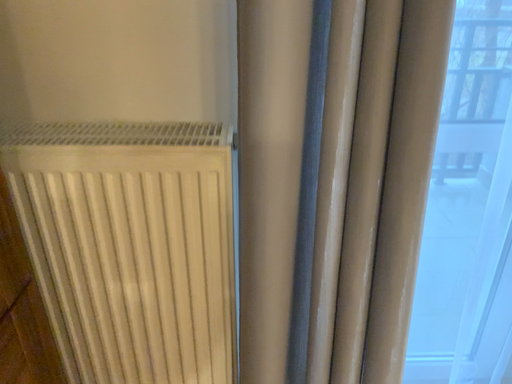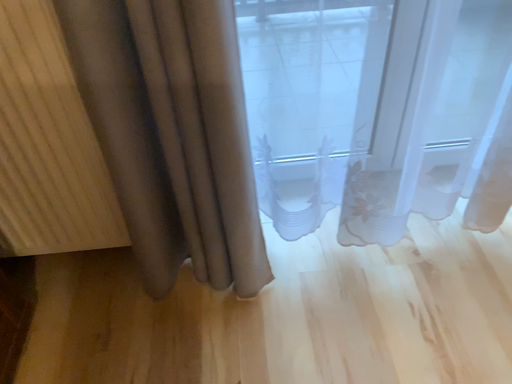
Question: Which way did the camera rotate in the video?

Choices:
 (A) rotated downward
 (B) rotated upward

Answer: (A)